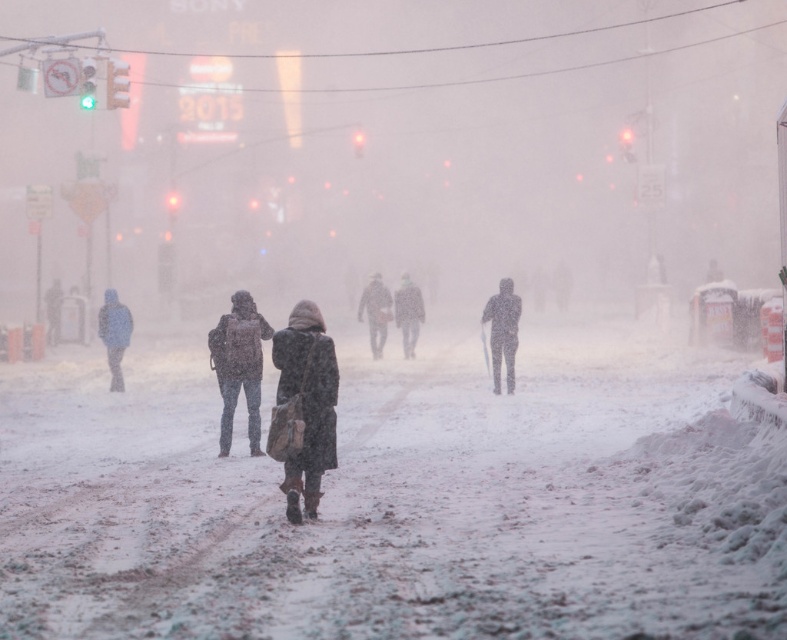
Which is more to the right, white fluffy snow at center or dark brown coat at center?

Positioned to the right is dark brown coat at center.

Between white fluffy snow at center and dark brown coat at center, which one is positioned higher?

dark brown coat at center

The image size is (787, 640). In order to click on white fluffy snow at center in this screenshot , I will do (398, 499).

Locate an element on the screen. Image resolution: width=787 pixels, height=640 pixels. white fluffy snow at center is located at coordinates (398, 499).

Who is shorter, white snow-covered figure at center or dark gray coat at left?

With less height is dark gray coat at left.

Can you confirm if white snow-covered figure at center is thinner than dark gray coat at left?

Correct, white snow-covered figure at center's width is less than dark gray coat at left's.

Does point (497, 394) lie behind point (113, 310)?

That is False.

At what (x,y) coordinates should I click in order to perform the action: click on white snow-covered figure at center. Please return your answer as a coordinate pair (x, y). Looking at the image, I should click on (501, 332).

Does white fluffy snow at center appear under dark gray coat at left?

Yes, white fluffy snow at center is below dark gray coat at left.

Does white fluffy snow at center appear on the right side of dark gray coat at left?

Correct, you'll find white fluffy snow at center to the right of dark gray coat at left.

Does point (19, 493) come behind point (119, 385)?

No, it is in front of (119, 385).

The image size is (787, 640). Identify the location of white fluffy snow at center. (398, 499).